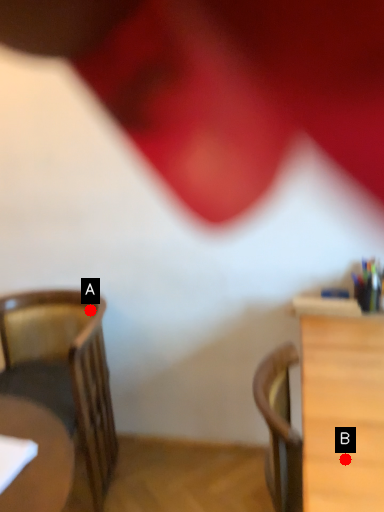
Question: Two points are circled on the image, labeled by A and B beside each circle. Which point is closer to the camera?

Choices:
 (A) A is closer
 (B) B is closer

Answer: (B)